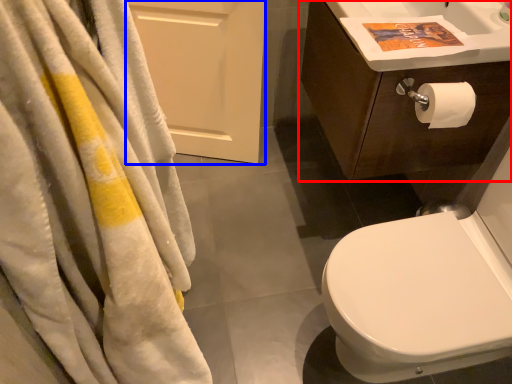
Question: Which object is closer to the camera taking this photo, bathroom cabinet (highlighted by a red box) or screen door (highlighted by a blue box)?

Choices:
 (A) bathroom cabinet
 (B) screen door

Answer: (A)